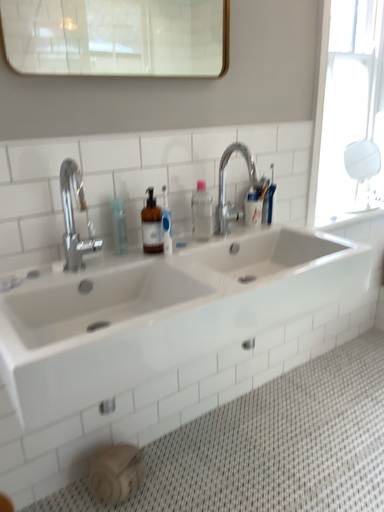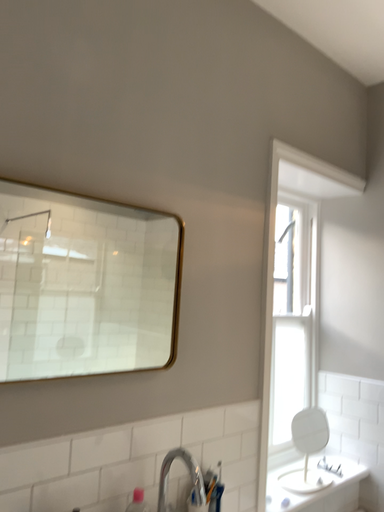
Question: Which way did the camera rotate in the video?

Choices:
 (A) rotated right
 (B) rotated left

Answer: (A)